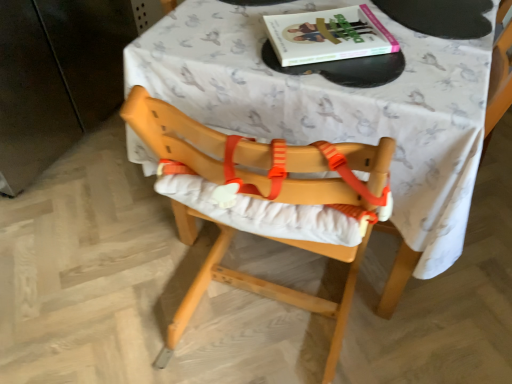
Question: Looking at their shapes, would you say white fabric-covered table at center is wider or thinner than natural wood highchair at center?

Choices:
 (A) thin
 (B) wide

Answer: (B)

Question: From the image's perspective, relative to natural wood highchair at center, is white fabric-covered table at center above or below?

Choices:
 (A) above
 (B) below

Answer: (A)

Question: Which is nearer to the hardcover book at upper center?

Choices:
 (A) white fabric-covered table at center
 (B) natural wood highchair at center

Answer: (A)

Question: Which object is the closest to the hardcover book at upper center?

Choices:
 (A) white fabric-covered table at center
 (B) natural wood highchair at center

Answer: (A)